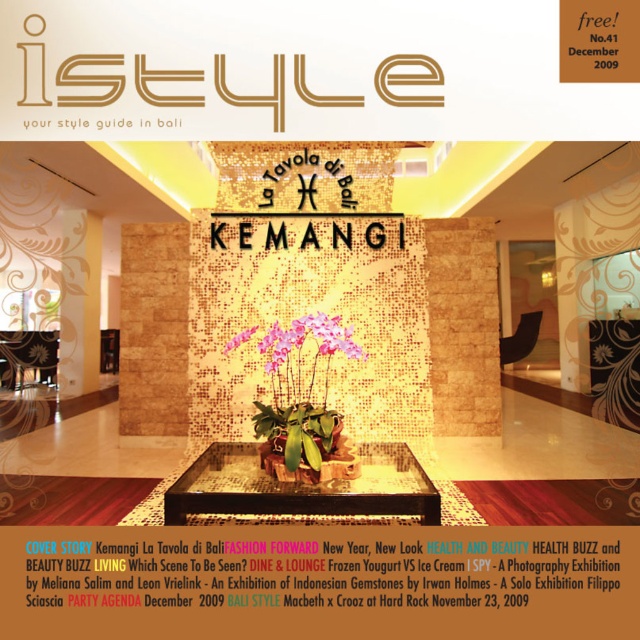
Is the position of matte gold mosaic wall at center less distant than that of black mosaic table at center?

No, matte gold mosaic wall at center is behind black mosaic table at center.

Measure the distance from matte gold mosaic wall at center to black mosaic table at center.

They are 5.30 feet apart.

Is point (468, 400) positioned after point (248, 445)?

Yes, it is.

Identify the location of matte gold mosaic wall at center. (260, 371).

Is black mosaic table at center above pink matte orchid at center?

Actually, black mosaic table at center is below pink matte orchid at center.

Consider the image. Which is above, black mosaic table at center or pink matte orchid at center?

pink matte orchid at center

Does point (336, 492) come closer to viewer compared to point (260, 340)?

Yes, point (336, 492) is in front of point (260, 340).

Where is `black mosaic table at center`? black mosaic table at center is located at coordinates (301, 486).

Does matte gold mosaic wall at center have a lesser width compared to pink matte orchid at center?

No, matte gold mosaic wall at center is not thinner than pink matte orchid at center.

Can you confirm if matte gold mosaic wall at center is positioned to the right of pink matte orchid at center?

In fact, matte gold mosaic wall at center is to the left of pink matte orchid at center.

Between point (497, 472) and point (344, 342), which one is positioned behind?

The point (497, 472) is behind.

Image resolution: width=640 pixels, height=640 pixels. In order to click on matte gold mosaic wall at center in this screenshot , I will do `click(260, 371)`.